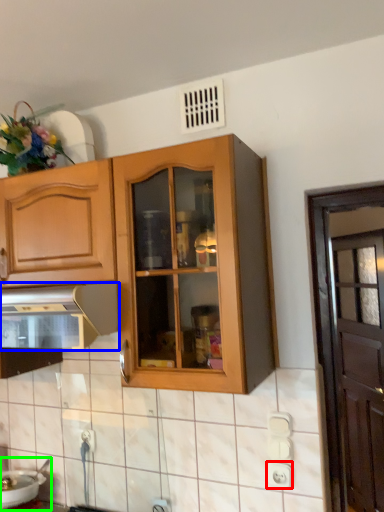
Question: Considering the real-world distances, which object is farthest from electric outlet (highlighted by a red box)? kitchen appliance (highlighted by a blue box) or sink (highlighted by a green box)?

Choices:
 (A) kitchen appliance
 (B) sink

Answer: (B)